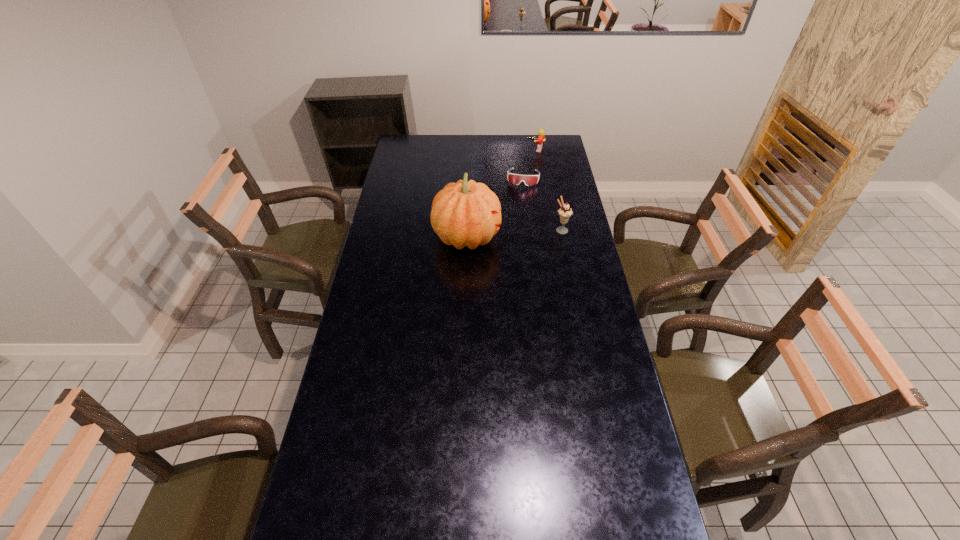
At what (x,y) coordinates should I click in order to perform the action: click on free space located in front of the third tallest object with the accessory visible. Please return your answer as a coordinate pair (x, y). Image resolution: width=960 pixels, height=540 pixels. Looking at the image, I should click on (529, 162).

I want to click on vacant region located in front of the third tallest object with the accessory visible, so click(520, 182).

At what (x,y) coordinates should I click in order to perform the action: click on free space located 0.280m on the front-facing side of the shortest object. Please return your answer as a coordinate pair (x, y). The height and width of the screenshot is (540, 960). Looking at the image, I should click on (517, 225).

The image size is (960, 540). I want to click on free space located on the front-facing side of the shortest object, so click(x=516, y=242).

Where is `blank space located on the front-facing side of the shortest object`? blank space located on the front-facing side of the shortest object is located at coordinates (521, 197).

This screenshot has width=960, height=540. In order to click on object located in the far edge section of the desktop in this screenshot , I will do `click(541, 137)`.

This screenshot has height=540, width=960. In order to click on icecream located at the right edge in this screenshot , I will do `click(565, 212)`.

Identify the location of Lego that is positioned at the right edge. The image size is (960, 540). (541, 137).

Locate an element on the screen. The height and width of the screenshot is (540, 960). goggles that is positioned at the right edge is located at coordinates (529, 180).

Where is `object that is at the far right corner`? The image size is (960, 540). object that is at the far right corner is located at coordinates (541, 137).